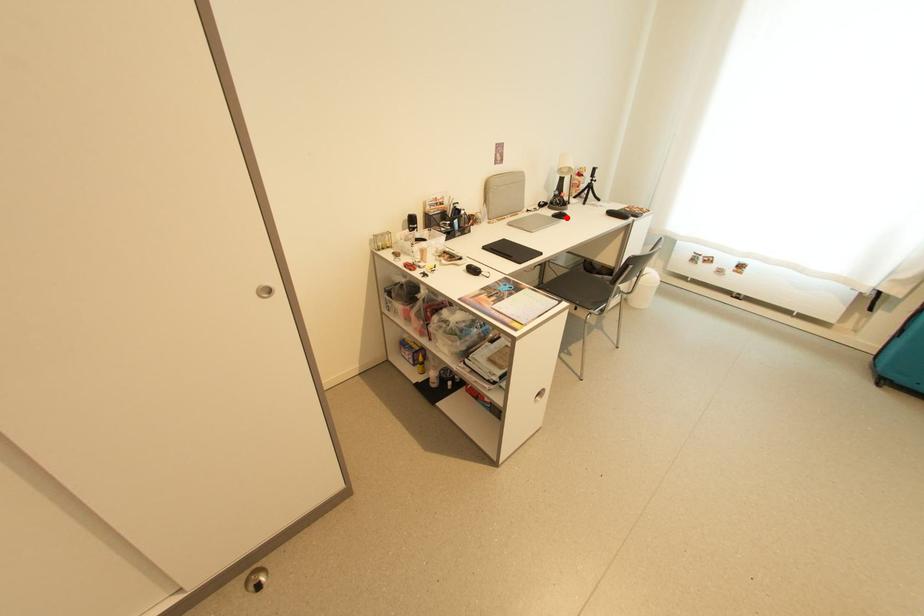
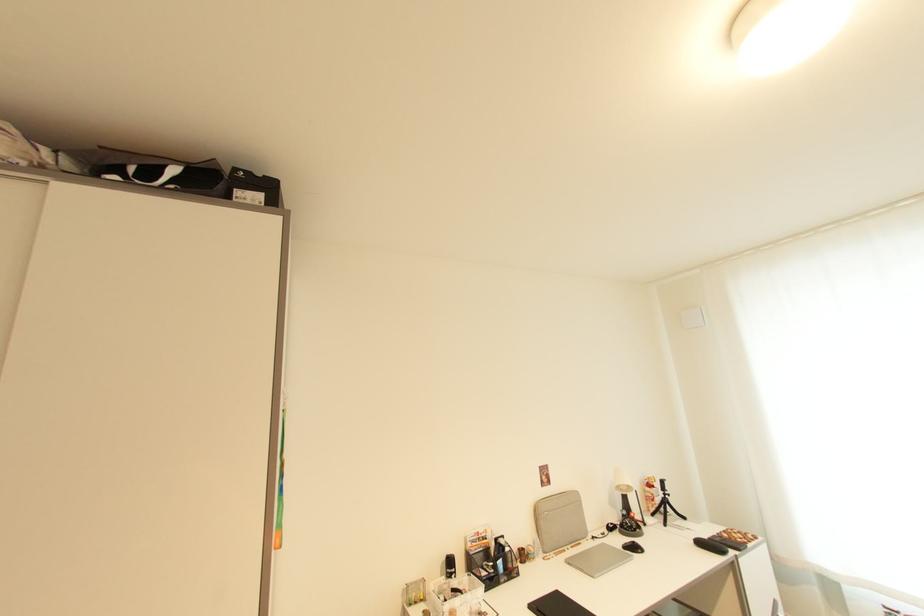
In the second image, find the point that corresponds to the highlighted location in the first image.

(639, 549)